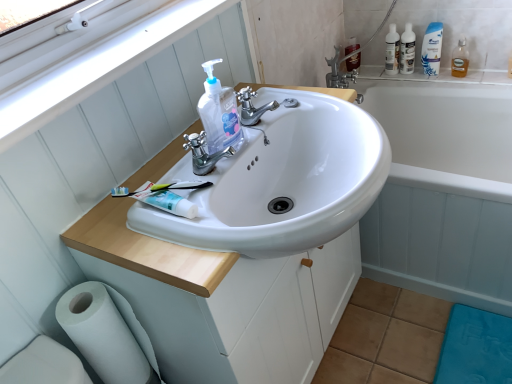
Question: Considering their positions, is translucent plastic mouthwash at upper right, the second mouthwash positioned from the left, located in front of or behind white matte toilet paper at lower left?

Choices:
 (A) front
 (B) behind

Answer: (B)

Question: From their relative heights in the image, would you say translucent plastic mouthwash at upper right, the second mouthwash positioned from the left, is taller or shorter than white matte toilet paper at lower left?

Choices:
 (A) tall
 (B) short

Answer: (B)

Question: Considering the real-world distances, which object is closest to the translucent plastic mouthwash at upper right, which is counted as the 1th mouthwash, starting from the right?

Choices:
 (A) white glossy shampoo bottle at upper right, the 2th cleaning product in the front-to-back sequence
 (B) clear plastic bottle at upper right
 (C) white plastic window frame at upper left
 (D) white glossy cabinet at center
 (E) clear plastic hand soap at center, the 3th cleaning product when ordered from right to left

Answer: (A)

Question: Based on their relative distances, which object is farther from the white plastic window frame at upper left?

Choices:
 (A) silver metallic faucet at center, arranged as the second tap when viewed from the front
 (B) translucent plastic mouthwash at upper right, which is counted as the 1th mouthwash, starting from the right
 (C) white glossy bathtub at upper right
 (D) white glossy shampoo bottle at upper right, the second cleaning product viewed from the back
 (E) clear plastic bottle at upper right

Answer: (B)